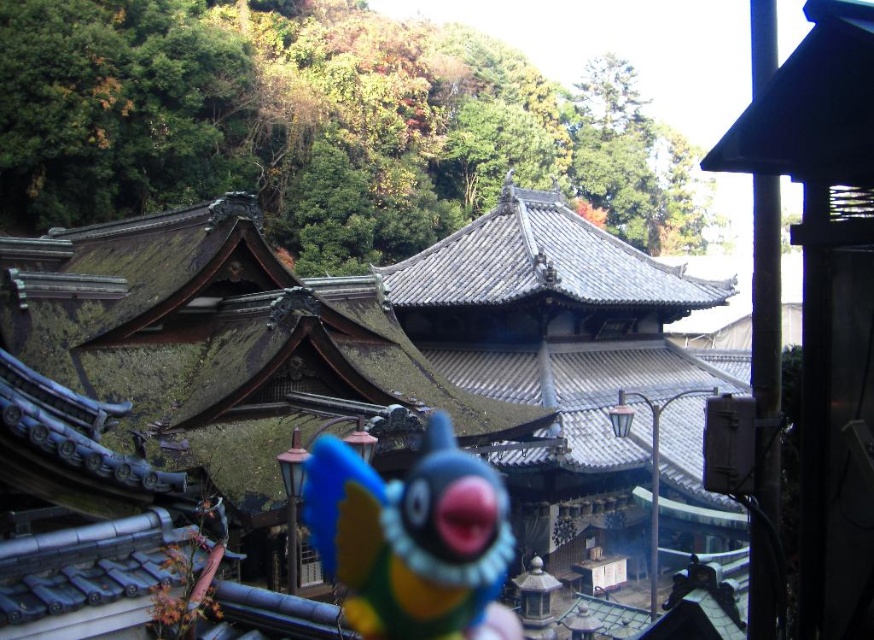
Locate an element on the screen. The image size is (874, 640). rusty metal roof at center is located at coordinates (274, 385).

Which is in front, point (164, 492) or point (376, 480)?

Positioned in front is point (164, 492).

Image resolution: width=874 pixels, height=640 pixels. Identify the location of rusty metal roof at center. (274, 385).